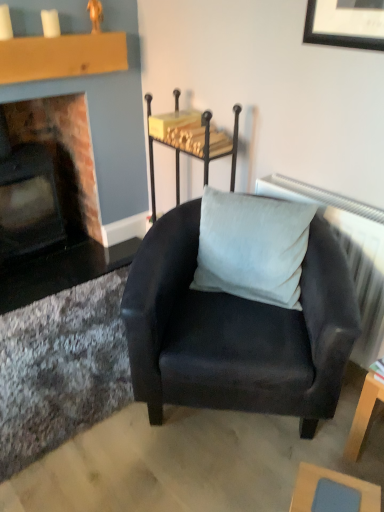
Question: Can you confirm if suede black armchair at center is smaller than wooden table at lower right, which appears as the second table when ordered from the bottom?

Choices:
 (A) yes
 (B) no

Answer: (B)

Question: Does suede black armchair at center lie behind wooden table at lower right, which ranks as the first table in right-to-left order?

Choices:
 (A) no
 (B) yes

Answer: (A)

Question: Is suede black armchair at center completely or partially outside of wooden table at lower right, which is counted as the 2th table, starting from the front?

Choices:
 (A) yes
 (B) no

Answer: (A)

Question: Is suede black armchair at center at the left side of wooden table at lower right, which ranks as the second table in top-to-bottom order?

Choices:
 (A) no
 (B) yes

Answer: (B)

Question: Is suede black armchair at center bigger than wooden table at lower right, the 2th table from the back?

Choices:
 (A) yes
 (B) no

Answer: (A)

Question: Looking at their shapes, would you say metallic black table at upper center, which is the 1th table from top to bottom, is wider or thinner than suede-like gray pillow at center?

Choices:
 (A) wide
 (B) thin

Answer: (A)

Question: In the image, is metallic black table at upper center, which is the 1th table from top to bottom, positioned in front of or behind suede-like gray pillow at center?

Choices:
 (A) behind
 (B) front

Answer: (A)

Question: Does point (185, 130) appear closer or farther from the camera than point (246, 195)?

Choices:
 (A) farther
 (B) closer

Answer: (A)

Question: From a real-world perspective, is metallic black table at upper center, the third table in the front-to-back sequence, positioned above or below suede-like gray pillow at center?

Choices:
 (A) below
 (B) above

Answer: (B)

Question: In terms of size, does gray fabric radiator at upper right appear bigger or smaller than matte brick fireplace at left?

Choices:
 (A) small
 (B) big

Answer: (A)

Question: Would you say gray fabric radiator at upper right is inside or outside matte brick fireplace at left?

Choices:
 (A) outside
 (B) inside

Answer: (A)

Question: Considering the relative positions of gray fabric radiator at upper right and matte brick fireplace at left in the image provided, is gray fabric radiator at upper right to the left or to the right of matte brick fireplace at left?

Choices:
 (A) right
 (B) left

Answer: (A)

Question: Considering their positions, is gray fabric radiator at upper right located in front of or behind matte brick fireplace at left?

Choices:
 (A) front
 (B) behind

Answer: (A)

Question: Is point (236, 112) positioned closer to the camera than point (372, 494)?

Choices:
 (A) closer
 (B) farther

Answer: (B)

Question: Considering the relative positions of metallic black table at upper center, placed as the 3th table when sorted from bottom to top, and light blue fabric table at lower right, which appears as the 1th table when ordered from the bottom, in the image provided, is metallic black table at upper center, placed as the 3th table when sorted from bottom to top, to the left or to the right of light blue fabric table at lower right, which appears as the 1th table when ordered from the bottom,?

Choices:
 (A) left
 (B) right

Answer: (A)